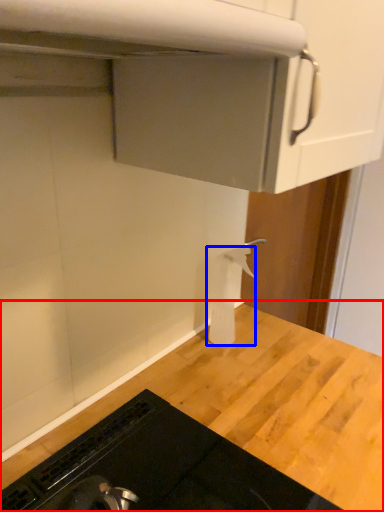
Question: Which of the following is the closest to the observer, countertop (highlighted by a red box) or toilet paper (highlighted by a blue box)?

Choices:
 (A) countertop
 (B) toilet paper

Answer: (A)